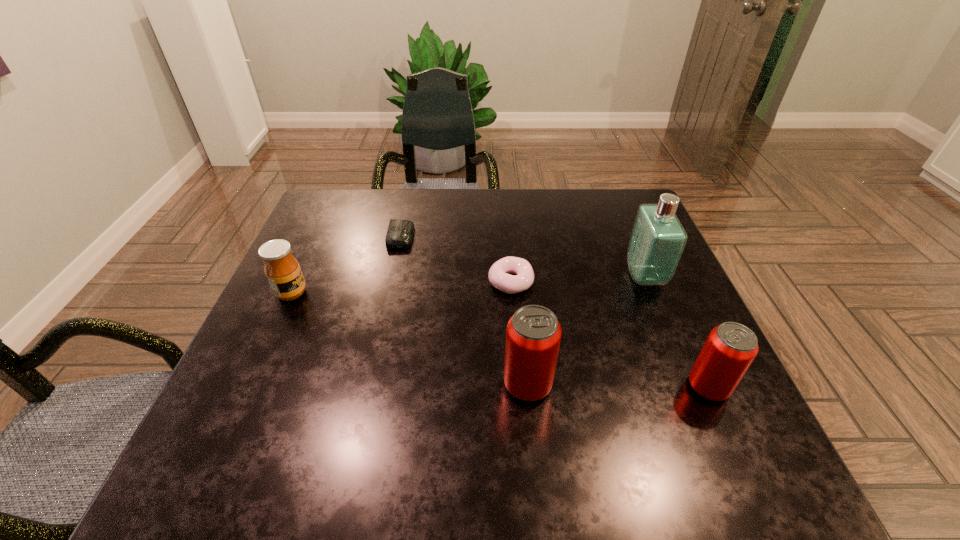
Find the location of a particular element. free space located 0.250m on the display of the farthest object is located at coordinates (506, 237).

I want to click on blank space located on the front label of the tallest object, so click(x=595, y=276).

I want to click on free space located 0.380m on the front label of the tallest object, so click(x=471, y=276).

Where is `blank area located on the front label of the tallest object`? Image resolution: width=960 pixels, height=540 pixels. blank area located on the front label of the tallest object is located at coordinates (550, 276).

At what (x,y) coordinates should I click in order to perform the action: click on free space located 0.310m on the back of the doughnut. Please return your answer as a coordinate pair (x, y). The image size is (960, 540). Looking at the image, I should click on (505, 200).

At what (x,y) coordinates should I click in order to perform the action: click on free space located 0.180m on the front-facing side of the leftmost object. Please return your answer as a coordinate pair (x, y). Looking at the image, I should click on (384, 293).

This screenshot has height=540, width=960. Find the location of `object that is at the far edge`. object that is at the far edge is located at coordinates (399, 235).

Find the location of a particular element. This screenshot has height=540, width=960. object located at the left edge is located at coordinates (x=282, y=270).

Where is `can that is at the right edge`? The image size is (960, 540). can that is at the right edge is located at coordinates (731, 347).

Where is `perfume positioned at the right edge`? This screenshot has width=960, height=540. perfume positioned at the right edge is located at coordinates (657, 241).